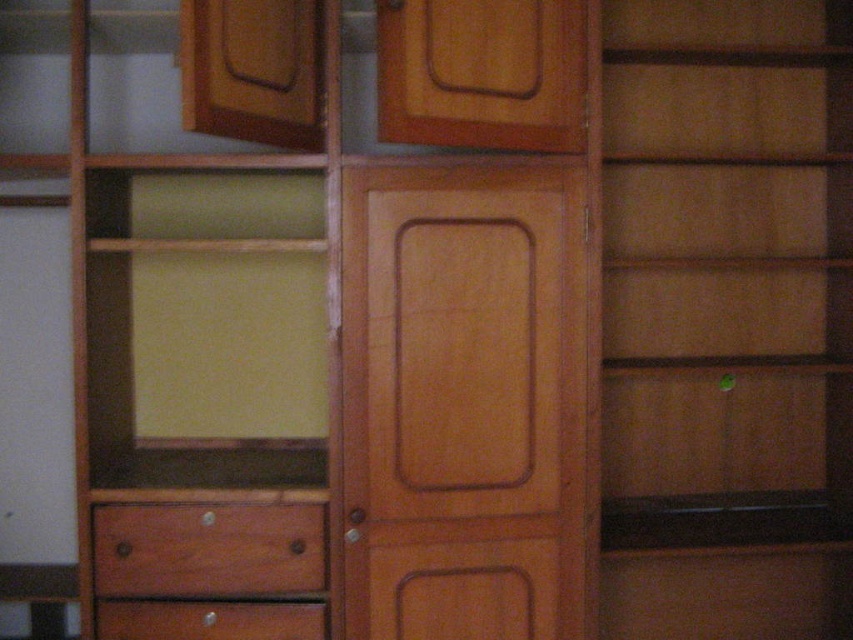
Consider the image. You are organizing a kitchen and need to place a rectangular plate rack that is 12 inches wide. You have two options for placement next to the cabinetry shown. The first option is next to the matte wood door at center, and the second is next to the brown wood drawer at lower left. Which location provides enough space for the plate rack?

The matte wood door at center has a larger width than the brown wood drawer at lower left, so placing the plate rack next to the matte wood door at center would provide sufficient space for the 12 inch wide plate rack.